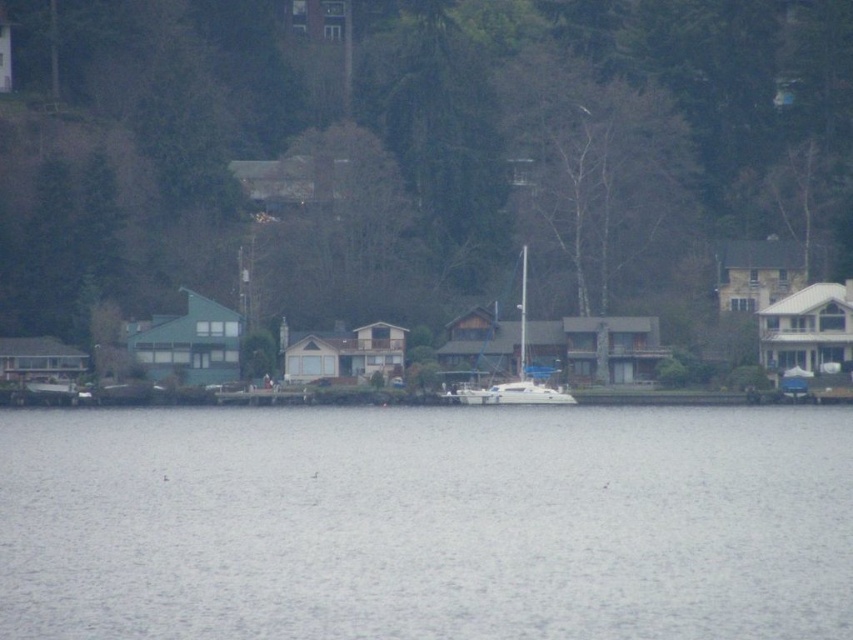
Question: Which of the following is the closest to the observer?

Choices:
 (A) (463, 390)
 (B) (97, 429)

Answer: (B)

Question: In this image, where is gray water at center located relative to white glossy sailboat at center?

Choices:
 (A) left
 (B) right

Answer: (A)

Question: Which point appears closest to the camera in this image?

Choices:
 (A) (543, 396)
 (B) (135, 474)

Answer: (B)

Question: Observing the image, what is the correct spatial positioning of gray water at center in reference to white glossy sailboat at center?

Choices:
 (A) below
 (B) above

Answer: (A)

Question: Can you confirm if gray water at center is thinner than white glossy sailboat at center?

Choices:
 (A) yes
 (B) no

Answer: (B)